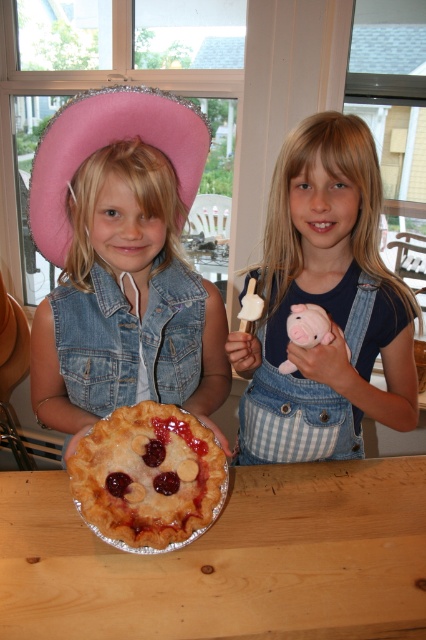
Question: Which is nearer to the golden flaky pie at center?

Choices:
 (A) wooden table at center
 (B) denim overalls at center
 (C) pink fabric straw hat at upper left

Answer: (A)

Question: Which point appears farthest from the camera in this image?

Choices:
 (A) (189, 205)
 (B) (101, 433)
 (C) (264, 248)
 (D) (63, 614)

Answer: (C)

Question: Does wooden table at center lie behind denim overalls at center?

Choices:
 (A) yes
 (B) no

Answer: (B)

Question: Does denim overalls at center appear on the left side of golden flaky pie at center?

Choices:
 (A) yes
 (B) no

Answer: (B)

Question: Which object appears farthest from the camera in this image?

Choices:
 (A) pink fabric straw hat at upper left
 (B) denim overalls at center
 (C) golden flaky pie at center

Answer: (B)

Question: Does denim overalls at center have a lesser width compared to golden flaky pie at center?

Choices:
 (A) no
 (B) yes

Answer: (A)